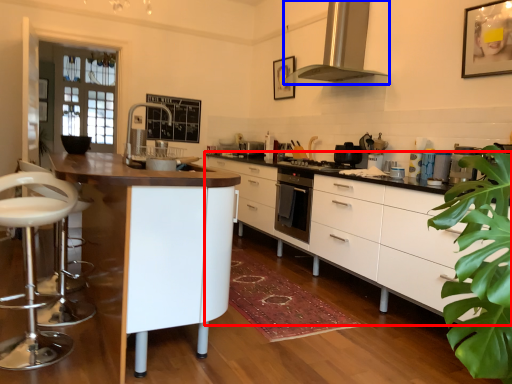
Question: Which of the following is the farthest to the observer, cabinetry (highlighted by a red box) or home appliance (highlighted by a blue box)?

Choices:
 (A) cabinetry
 (B) home appliance

Answer: (B)